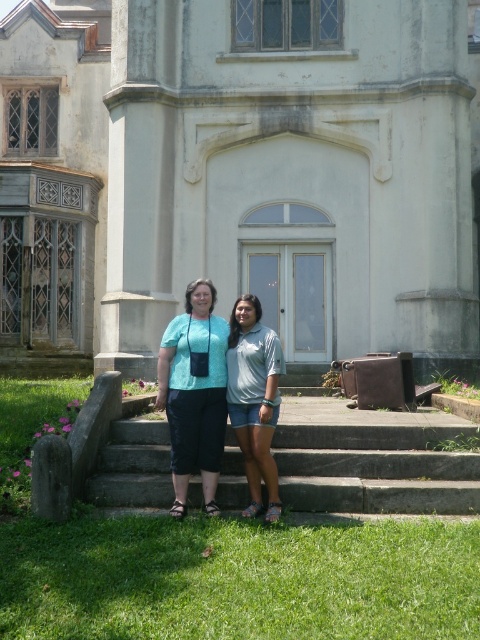
Is gray concrete stairs at center closer to camera compared to matte teal blouse at center?

No, it is behind matte teal blouse at center.

Is gray concrete stairs at center wider than matte teal blouse at center?

Indeed, gray concrete stairs at center has a greater width compared to matte teal blouse at center.

What do you see at coordinates (375, 468) in the screenshot? The image size is (480, 640). I see `gray concrete stairs at center` at bounding box center [375, 468].

In order to click on gray concrete stairs at center in this screenshot , I will do `click(375, 468)`.

Who is positioned more to the left, green grass at lower center or matte teal blouse at center?

Positioned to the left is matte teal blouse at center.

Is green grass at lower center wider than matte teal blouse at center?

Yes, green grass at lower center is wider than matte teal blouse at center.

Where is `green grass at lower center`? This screenshot has height=640, width=480. green grass at lower center is located at coordinates (238, 579).

Between gray concrete stairs at center and blue denim shorts at center, which one is positioned higher?

Positioned higher is blue denim shorts at center.

Who is shorter, gray concrete stairs at center or blue denim shorts at center?

gray concrete stairs at center

Does point (237, 486) come behind point (269, 369)?

Yes, it is behind point (269, 369).

You are a GUI agent. You are given a task and a screenshot of the screen. Output one action in this format:
    pyautogui.click(x=<x>, y=<y>)
    Task: Click on the gray concrete stairs at center
    
    Given the screenshot: What is the action you would take?
    pyautogui.click(x=375, y=468)